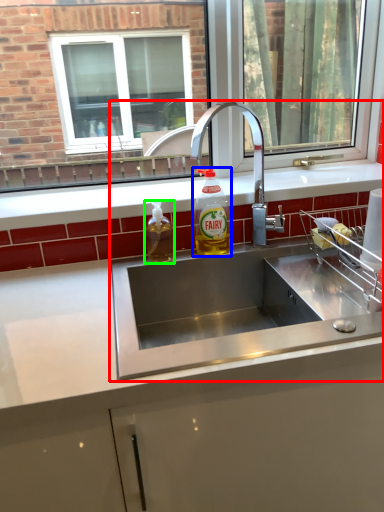
Question: Considering the real-world distances, which object is closest to sink (highlighted by a red box)? bottle (highlighted by a blue box) or bottle (highlighted by a green box).

Choices:
 (A) bottle
 (B) bottle

Answer: (A)